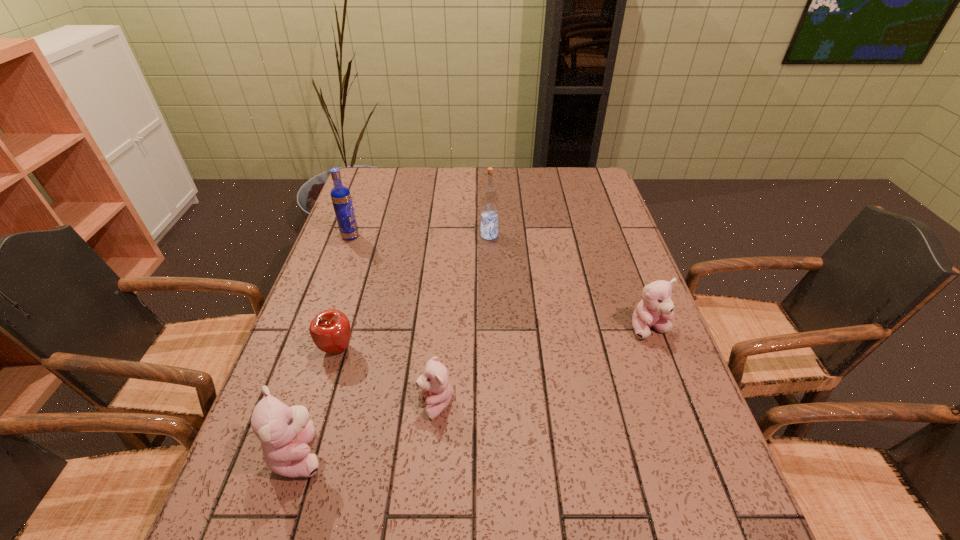
You are a GUI agent. You are given a task and a screenshot of the screen. Output one action in this format:
    pyautogui.click(x=<x>, y=<y>)
    Task: Click on the leftmost teddy bear
    The height and width of the screenshot is (540, 960).
    Given the screenshot: What is the action you would take?
    (x=285, y=432)

The height and width of the screenshot is (540, 960). In order to click on the nearest object in this screenshot , I will do `click(285, 432)`.

The image size is (960, 540). Find the location of `the second nearest object`. the second nearest object is located at coordinates (434, 384).

Identify the location of the shortest teddy bear. Image resolution: width=960 pixels, height=540 pixels. (434, 384).

Locate an element on the screen. This screenshot has width=960, height=540. the third shortest object is located at coordinates (655, 309).

The height and width of the screenshot is (540, 960). Identify the location of the rightmost object. (655, 309).

Find the location of a particular element. The image size is (960, 540). the right vodka is located at coordinates (489, 199).

This screenshot has height=540, width=960. I want to click on apple, so click(330, 330).

Find the location of `the left vodka`. the left vodka is located at coordinates (341, 198).

Where is `vacant space situated at the face of the leftmost teddy bear`? The image size is (960, 540). vacant space situated at the face of the leftmost teddy bear is located at coordinates (398, 453).